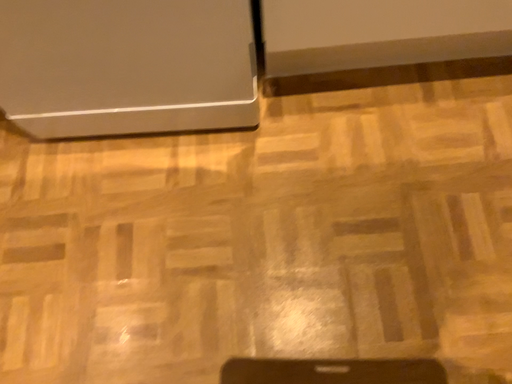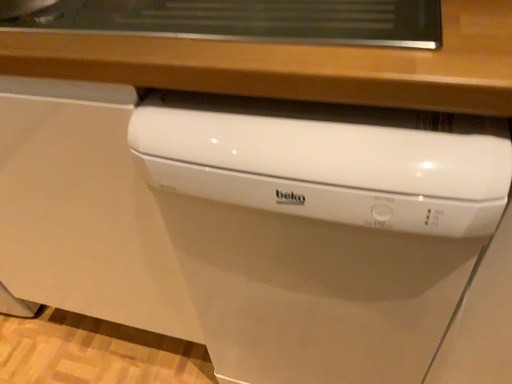
Question: How did the camera likely rotate when shooting the video?

Choices:
 (A) rotated upward
 (B) rotated downward

Answer: (A)